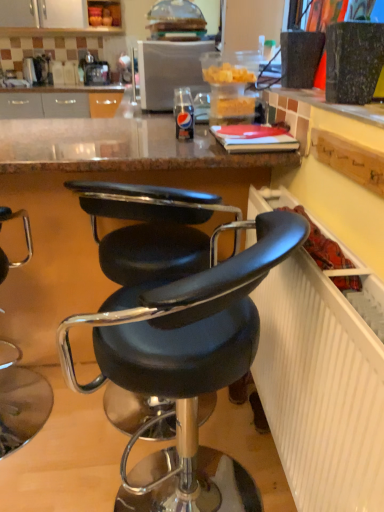
Question: Does black leather chair at center, positioned as the 2th chair in left-to-right order, appear on the right side of white textured radiator at lower right?

Choices:
 (A) yes
 (B) no

Answer: (B)

Question: Is black leather chair at center, positioned as the 2th chair in left-to-right order, closer to the viewer compared to white textured radiator at lower right?

Choices:
 (A) yes
 (B) no

Answer: (B)

Question: From the image's perspective, does black leather chair at center, the 1th chair in the right-to-left sequence, appear higher than white textured radiator at lower right?

Choices:
 (A) yes
 (B) no

Answer: (B)

Question: From a real-world perspective, is black leather chair at center, the 1th chair in the right-to-left sequence, positioned over white textured radiator at lower right based on gravity?

Choices:
 (A) no
 (B) yes

Answer: (A)

Question: Can you confirm if black leather chair at center, positioned as the 2th chair in left-to-right order, is shorter than white textured radiator at lower right?

Choices:
 (A) yes
 (B) no

Answer: (B)

Question: Based on their sizes in the image, would you say black leather chair at center, positioned as the 2th chair in left-to-right order, is bigger or smaller than black leather stool at lower left, the second chair when ordered from right to left?

Choices:
 (A) big
 (B) small

Answer: (A)

Question: From the image's perspective, is black leather chair at center, the 1th chair in the right-to-left sequence, located above or below black leather stool at lower left, marked as the 1th chair in a left-to-right arrangement?

Choices:
 (A) below
 (B) above

Answer: (A)

Question: Considering the relative positions of black leather chair at center, positioned as the 2th chair in left-to-right order, and black leather stool at lower left, the second chair when ordered from right to left, in the image provided, is black leather chair at center, positioned as the 2th chair in left-to-right order, to the left or to the right of black leather stool at lower left, the second chair when ordered from right to left,?

Choices:
 (A) right
 (B) left

Answer: (A)

Question: Relative to black leather stool at lower left, marked as the 1th chair in a left-to-right arrangement, is black leather chair at center, the 1th chair in the right-to-left sequence, in front or behind?

Choices:
 (A) front
 (B) behind

Answer: (A)

Question: From a real-world perspective, is white textured radiator at lower right positioned above or below black leather stool at lower left, the second chair when ordered from right to left?

Choices:
 (A) below
 (B) above

Answer: (B)

Question: Relative to black leather stool at lower left, the second chair when ordered from right to left, is white textured radiator at lower right in front or behind?

Choices:
 (A) front
 (B) behind

Answer: (A)

Question: Is white textured radiator at lower right situated inside black leather stool at lower left, marked as the 1th chair in a left-to-right arrangement, or outside?

Choices:
 (A) outside
 (B) inside

Answer: (A)

Question: Visually, is white textured radiator at lower right positioned to the left or to the right of black leather stool at lower left, the second chair when ordered from right to left?

Choices:
 (A) left
 (B) right

Answer: (B)

Question: Is point (39, 400) positioned closer to the camera than point (263, 218)?

Choices:
 (A) farther
 (B) closer

Answer: (A)

Question: Is black leather stool at lower left, marked as the 1th chair in a left-to-right arrangement, in front of or behind black leather chair at center, positioned as the 2th chair in left-to-right order, in the image?

Choices:
 (A) behind
 (B) front

Answer: (A)